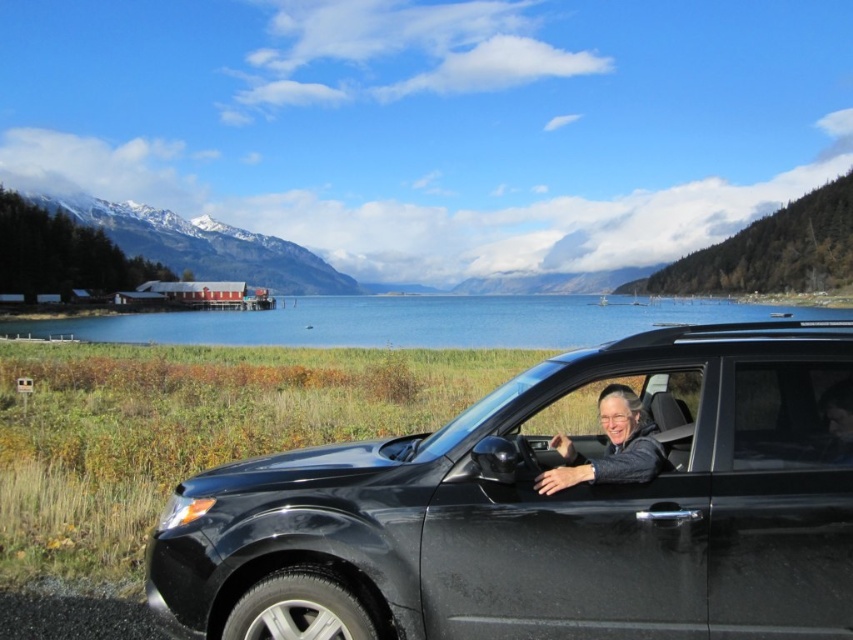
You are standing at the center of the image and want to find the glossy black suv at lower right. According to the coordinates provided, in which direction should you look to locate it?

The glossy black suv at lower right is located at coordinates point (549, 508), which means it is positioned to the right and slightly below the center of the image. Therefore, you should look towards the lower right direction to find it.

You are standing at the camera position and want to reach the point marked as point (177, 316). If you walk straight towards it, how far will you have to walk in feet?

The distance between the camera and point (177, 316) is 437.74 feet, so you will have to walk 437.74 feet straight towards it.